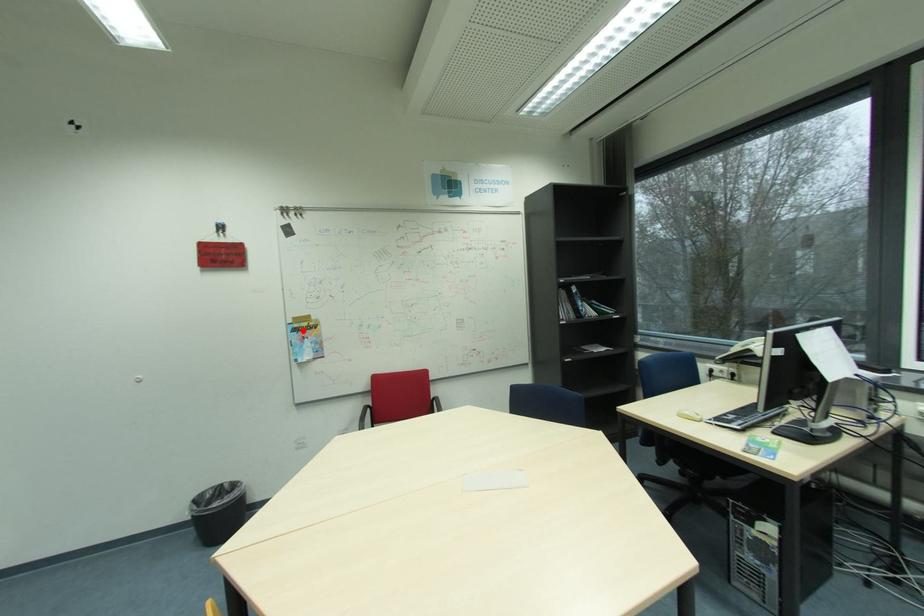
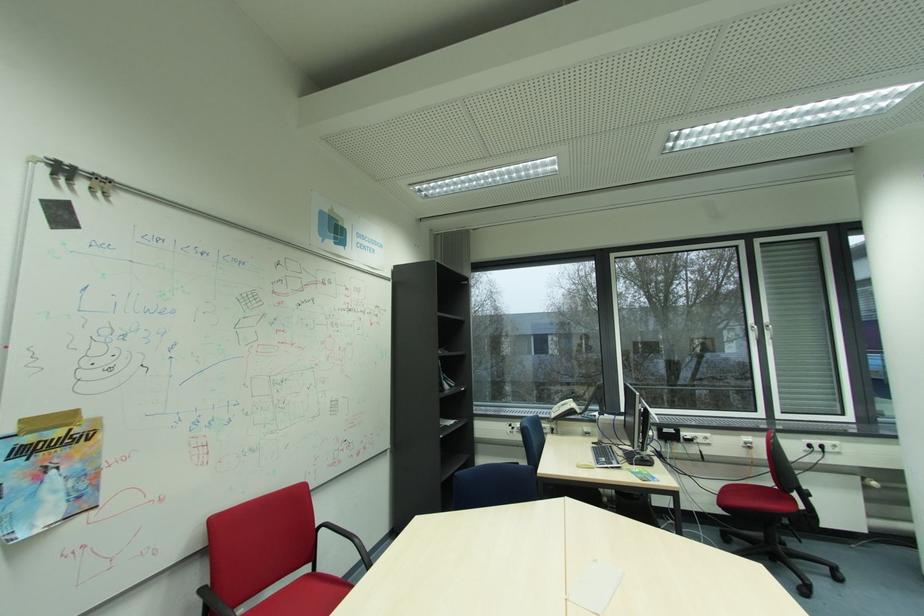
Locate, in the second image, the point that corresponds to the highlighted location in the first image.

(31, 452)